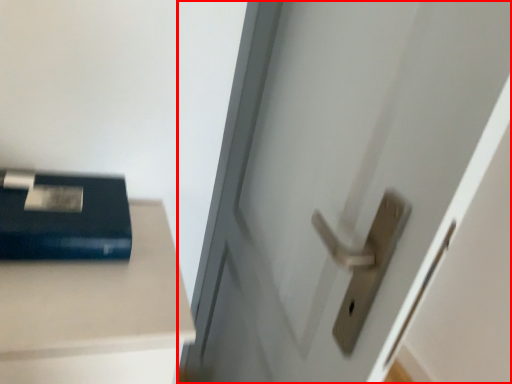
Question: From the image's perspective, what is the correct spatial positioning of door (annotated by the red box) in reference to paperback book?

Choices:
 (A) above
 (B) below

Answer: (B)